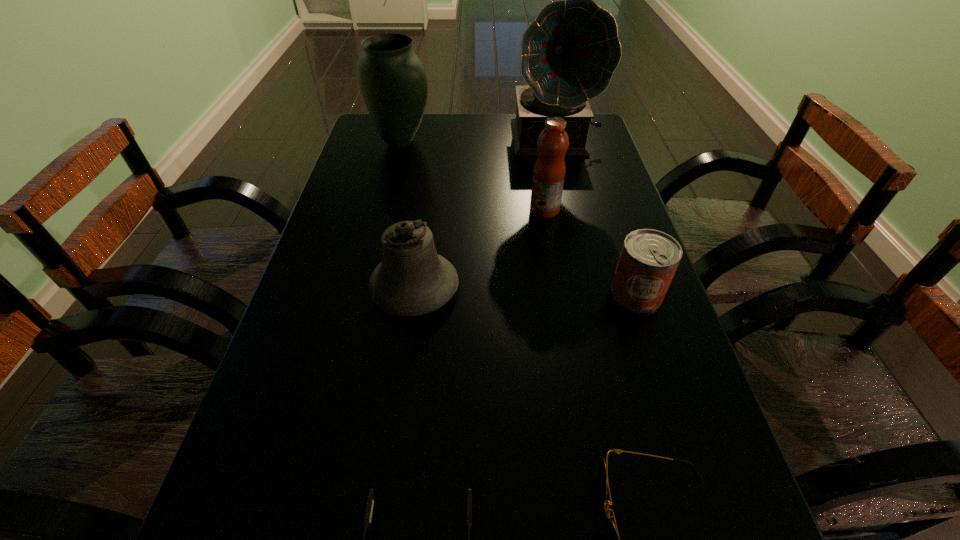
Where is `free space in the image that satisfies the following two spatial constraints: 1. on the horn of the tallest object; 2. on the front label of the third farthest object`? This screenshot has width=960, height=540. free space in the image that satisfies the following two spatial constraints: 1. on the horn of the tallest object; 2. on the front label of the third farthest object is located at coordinates (570, 210).